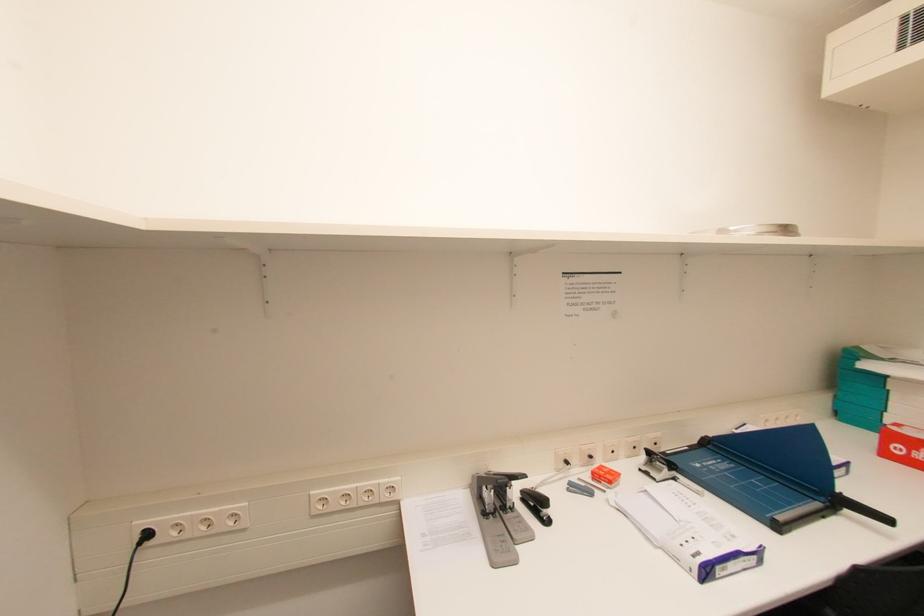
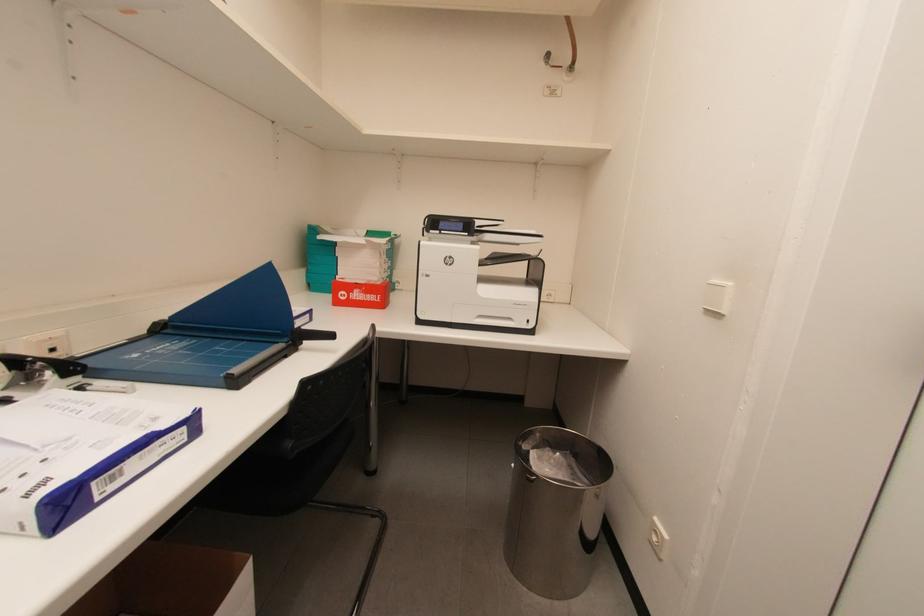
Question: The images are taken continuously from a first-person perspective. In which direction is your viewpoint rotating?

Choices:
 (A) Left
 (B) Right
 (C) Up
 (D) Down

Answer: (B)